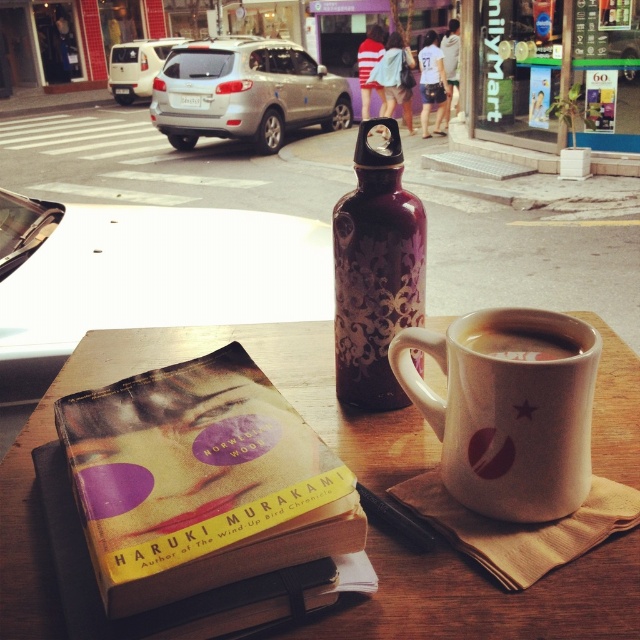
Who is taller, hardcover book at center or purple metallic water bottle at center?

Standing taller between the two is purple metallic water bottle at center.

Describe the element at coordinates (200, 481) in the screenshot. The width and height of the screenshot is (640, 640). I see `hardcover book at center` at that location.

The image size is (640, 640). I want to click on hardcover book at center, so click(200, 481).

Who is more forward, (403, 442) or (106, 556)?

Point (106, 556)

This screenshot has height=640, width=640. What do you see at coordinates (164, 364) in the screenshot?
I see `wooden table at center` at bounding box center [164, 364].

The width and height of the screenshot is (640, 640). Find the location of `wooden table at center`. wooden table at center is located at coordinates (164, 364).

Does white matte mug at upper center have a lesser height compared to purple metallic water bottle at center?

Yes, white matte mug at upper center is shorter than purple metallic water bottle at center.

Who is shorter, white matte mug at upper center or purple metallic water bottle at center?

With less height is white matte mug at upper center.

Is point (529, 400) behind point (420, 244)?

No.

At what (x,y) coordinates should I click in order to perform the action: click on white matte mug at upper center. Please return your answer as a coordinate pair (x, y). The width and height of the screenshot is (640, 640). Looking at the image, I should click on (508, 412).